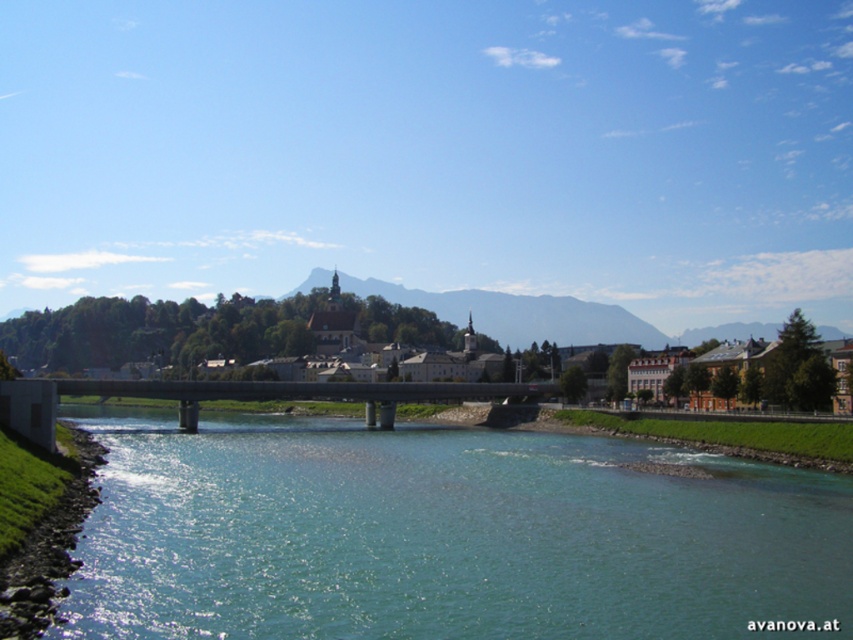
Consider the image. You are standing at the riverside and want to take a photo of both point (241, 531) and point (433, 381) in the scene. Which point should you focus on first to ensure both are in clear view?

You should focus on point (241, 531) first because it is closer to the camera than point (433, 381). This ensures both points will be in focus as the closer point sets the focal plane.

You are standing on the riverside path and want to cross to the other side. The clear water at center flows from left to right. If you decide to cross using the concrete bridge at center, which direction should you face to step onto the bridge first?

You should face to the left because the clear water at center is to the right of the concrete bridge at center, meaning the bridge is on the left side relative to the water flow direction.

You are standing at the starting point of the bridge and want to cross to the right bank. The clear water at center is directly below you. Can you safely step onto the right bank without getting your feet wet?

The clear water at center is located at point (445,536), which means it is directly below you. Since the right bank is on the opposite side of the river, you need to continue walking forward across the bridge to reach it safely without stepping into the water.